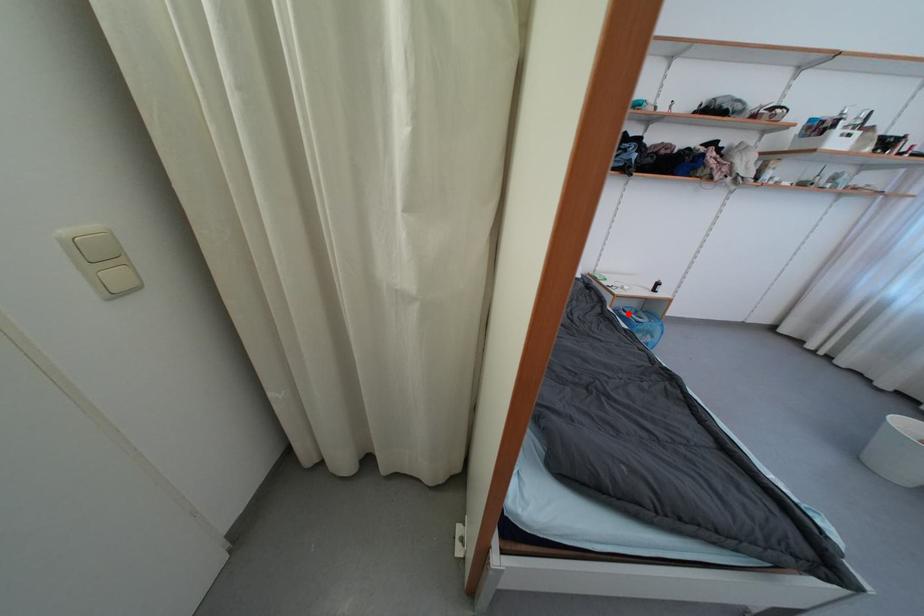
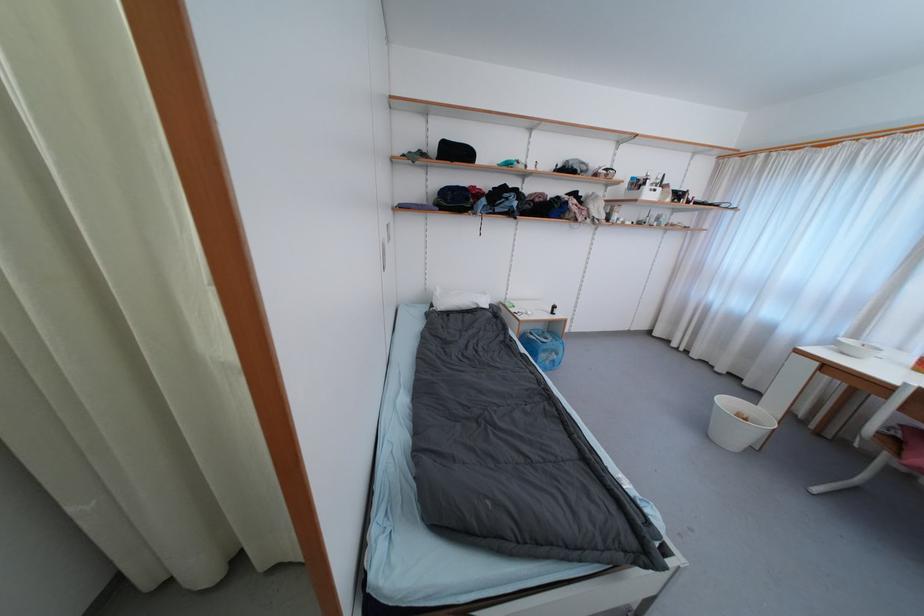
The point at the highlighted location is marked in the first image. Where is the corresponding point in the second image?

(535, 336)